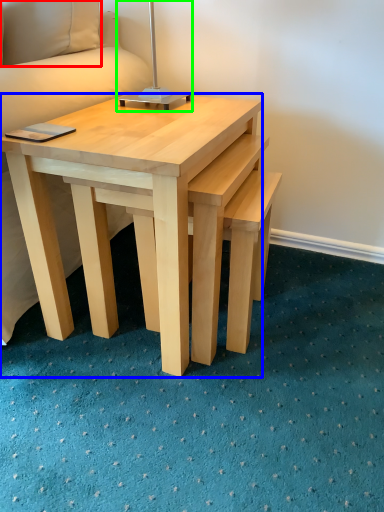
Question: Based on their relative distances, which object is nearer to pillow (highlighted by a red box)? Choose from coffee table (highlighted by a blue box) and bedside lamp (highlighted by a green box).

Choices:
 (A) coffee table
 (B) bedside lamp

Answer: (B)